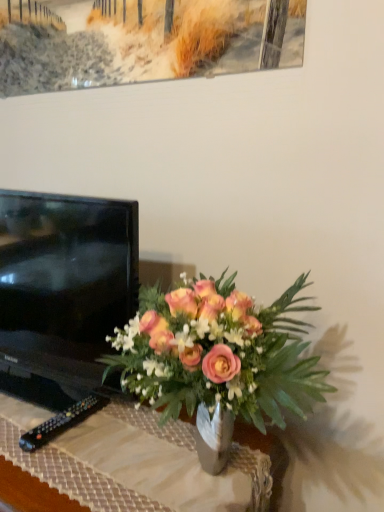
The image size is (384, 512). What do you see at coordinates (63, 291) in the screenshot?
I see `black glossy tv at left` at bounding box center [63, 291].

Identify the location of matte glass vase at center. (144, 462).

From the image's perspective, between black plastic remote at lower left and black glossy tv at left, which one is located above?

black glossy tv at left, from the image's perspective.

Considering the relative positions of black plastic remote at lower left and black glossy tv at left in the image provided, is black plastic remote at lower left in front of black glossy tv at left?

No.

Considering the points (94, 394) and (7, 387), which point is in front, point (94, 394) or point (7, 387)?

The point (94, 394) is more forward.

Is black plastic remote at lower left turned away from black glossy tv at left?

Yes, black plastic remote at lower left is facing away from black glossy tv at left.

From the image's perspective, between matte glass vase at center and black glossy tv at left, who is located below?

matte glass vase at center.

Find the location of a particular element. The image size is (384, 512). television behind the matte glass vase at center is located at coordinates (63, 291).

Which is correct: matte glass vase at center is inside black glossy tv at left, or outside of it?

matte glass vase at center is spatially situated outside black glossy tv at left.

Who is bigger, matte glass vase at center or black glossy tv at left?

With larger size is black glossy tv at left.

Is matte glass vase at center situated inside black plastic remote at lower left or outside?

matte glass vase at center cannot be found inside black plastic remote at lower left.

Considering the points (176, 441) and (72, 425), which point is behind, point (176, 441) or point (72, 425)?

The point (72, 425) is farther.

Is matte glass vase at center wider than black plastic remote at lower left?

Correct, the width of matte glass vase at center exceeds that of black plastic remote at lower left.

Does matte glass vase at center appear on the left side of black plastic remote at lower left?

Yes.

Would you say matte glass vase at center is a long distance from matte glass vase at center?

No, there isn't a large distance between matte glass vase at center and matte glass vase at center.

Between matte glass vase at center and matte glass vase at center, which one has more height?

matte glass vase at center is taller.

Is matte glass vase at center completely or partially outside of matte glass vase at center?

Indeed, matte glass vase at center is completely outside matte glass vase at center.

Is matte glass vase at center oriented away from matte glass vase at center?

No, matte glass vase at center is not at the back of matte glass vase at center.

Identify the location of houseplant on the right of black plastic remote at lower left. (216, 359).

Is the depth of matte glass vase at center greater than that of black plastic remote at lower left?

That is False.

From the image's perspective, which one is positioned lower, matte glass vase at center or black plastic remote at lower left?

black plastic remote at lower left is shown below in the image.

From a real-world perspective, between black glossy tv at left and matte glass vase at center, who is vertically lower?

matte glass vase at center is physically lower.

Does black glossy tv at left contain matte glass vase at center?

That's incorrect, matte glass vase at center is not inside black glossy tv at left.

What's the angular difference between black glossy tv at left and matte glass vase at center's facing directions?

6.27 degrees.

Considering the positions of objects black glossy tv at left and matte glass vase at center in the image provided, who is behind, black glossy tv at left or matte glass vase at center?

black glossy tv at left.

Relative to matte glass vase at center, is black glossy tv at left in front or behind?

Visually, black glossy tv at left is located behind matte glass vase at center.

This screenshot has width=384, height=512. I want to click on television that is above the matte glass vase at center (from a real-world perspective), so click(x=63, y=291).

How much distance is there between black glossy tv at left and matte glass vase at center?

They are 23.03 centimeters apart.

Is black glossy tv at left completely or partially outside of matte glass vase at center?

Absolutely, black glossy tv at left is external to matte glass vase at center.

Locate an element on the screen. remote behind the black glossy tv at left is located at coordinates (62, 422).

Find the location of a particular element. The image size is (384, 512). houseplant that appears below the black glossy tv at left (from the image's perspective) is located at coordinates (216, 359).

Estimate the real-world distances between objects in this image. Which object is further from matte glass vase at center, matte glass vase at center or black plastic remote at lower left?

Among the two, matte glass vase at center is located further to matte glass vase at center.

When comparing their distances from matte glass vase at center, does matte glass vase at center or black glossy tv at left seem further?

black glossy tv at left.

Which object lies further to the anchor point black plastic remote at lower left, black glossy tv at left or matte glass vase at center?

matte glass vase at center is positioned further to the anchor black plastic remote at lower left.

When comparing their distances from matte glass vase at center, does black plastic remote at lower left or black glossy tv at left seem further?

The object further to matte glass vase at center is black glossy tv at left.

From the image, which object appears to be nearer to black glossy tv at left, matte glass vase at center or matte glass vase at center?

Based on the image, matte glass vase at center appears to be nearer to black glossy tv at left.

Based on the photo, considering their positions, is matte glass vase at center positioned further to black glossy tv at left than black plastic remote at lower left?

black plastic remote at lower left.

From the image, which object appears to be farther from black plastic remote at lower left, matte glass vase at center or matte glass vase at center?

matte glass vase at center is positioned further to the anchor black plastic remote at lower left.

Looking at the image, which one is located further to black glossy tv at left, black plastic remote at lower left or matte glass vase at center?

black plastic remote at lower left.

Find the location of a particular element. The width and height of the screenshot is (384, 512). remote located between matte glass vase at center and matte glass vase at center in the left-right direction is located at coordinates (62, 422).

Where is `remote between black glossy tv at left and matte glass vase at center in the horizontal direction`? This screenshot has height=512, width=384. remote between black glossy tv at left and matte glass vase at center in the horizontal direction is located at coordinates (62, 422).

What are the coordinates of `remote between black glossy tv at left and matte glass vase at center in the vertical direction` in the screenshot? It's located at (62, 422).

Find the location of a particular element. The image size is (384, 512). houseplant between black glossy tv at left and matte glass vase at center in the vertical direction is located at coordinates (216, 359).